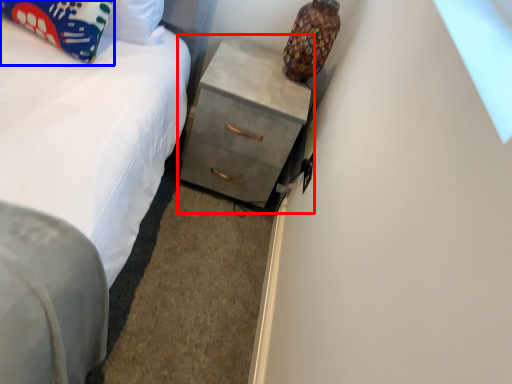
Question: Which of the following is the closest to the observer, chest of drawers (highlighted by a red box) or pillow (highlighted by a blue box)?

Choices:
 (A) chest of drawers
 (B) pillow

Answer: (B)